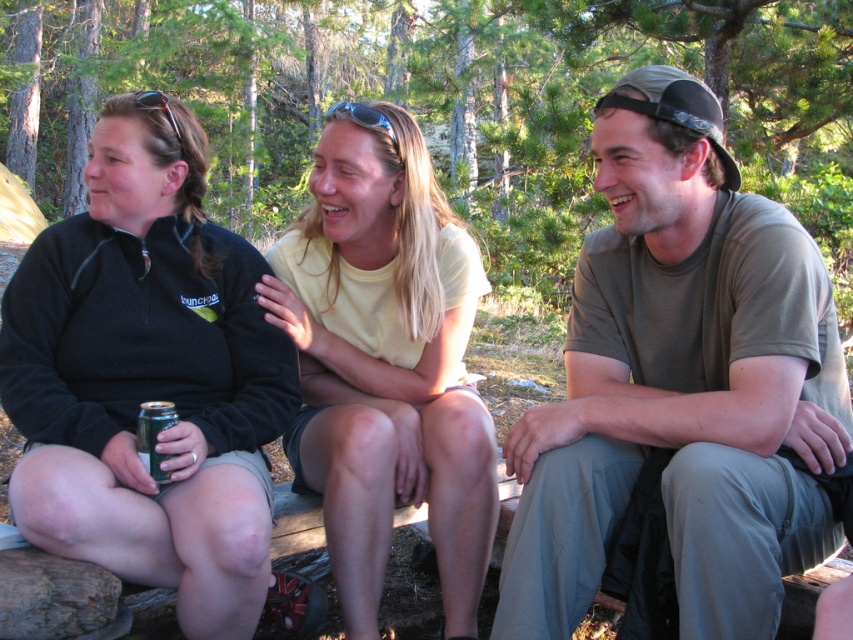
Question: Does black fleece jacket at left appear under yellow cotton shirt at center?

Choices:
 (A) yes
 (B) no

Answer: (B)

Question: Is black fleece jacket at left to the right of yellow cotton shirt at center from the viewer's perspective?

Choices:
 (A) no
 (B) yes

Answer: (A)

Question: Estimate the real-world distances between objects in this image. Which object is farther from the matte olive green t-shirt at center?

Choices:
 (A) black fleece jacket at left
 (B) yellow cotton shirt at center

Answer: (A)

Question: Does black fleece jacket at left lie behind yellow cotton shirt at center?

Choices:
 (A) no
 (B) yes

Answer: (A)

Question: Which of the following is the closest to the observer?

Choices:
 (A) yellow cotton shirt at center
 (B) black fleece jacket at left
 (C) matte olive green t-shirt at center

Answer: (C)

Question: Considering the real-world distances, which object is farthest from the matte olive green t-shirt at center?

Choices:
 (A) black fleece jacket at left
 (B) yellow cotton shirt at center

Answer: (A)